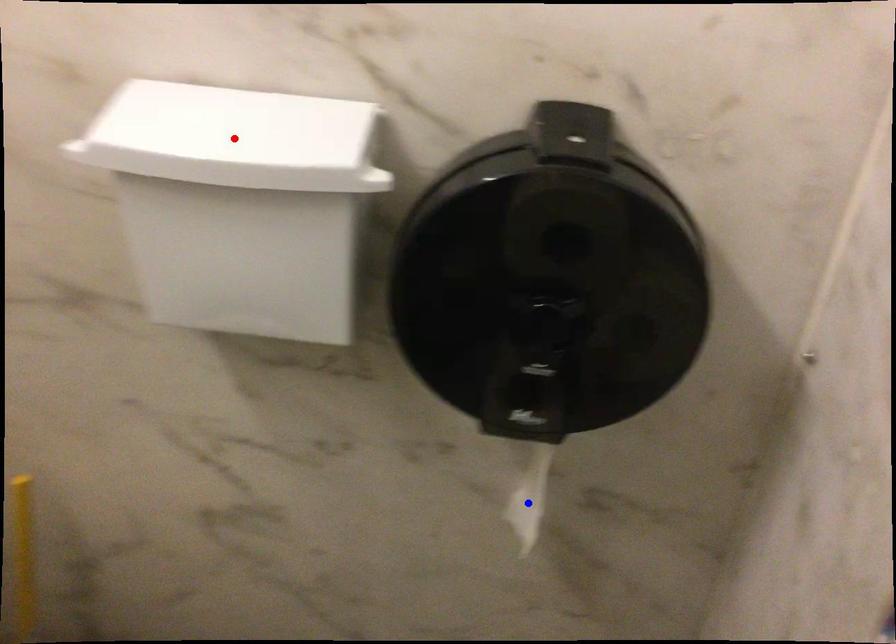
Question: Two points are marked on the image. Which point is closer to the camera?

Choices:
 (A) Blue point is closer.
 (B) Red point is closer.

Answer: (B)